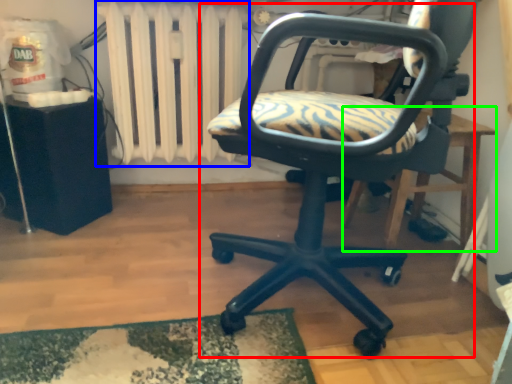
Question: Estimate the real-world distances between objects in this image. Which object is farther from chair (highlighted by a red box), radiator (highlighted by a blue box) or table (highlighted by a green box)?

Choices:
 (A) radiator
 (B) table

Answer: (A)